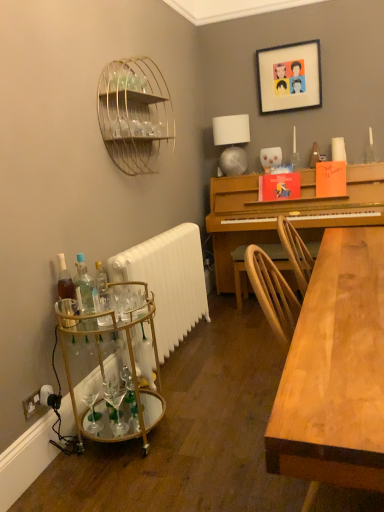
This screenshot has height=512, width=384. I want to click on vacant region above wooden picture frame at upper center (from a real-world perspective), so click(x=294, y=40).